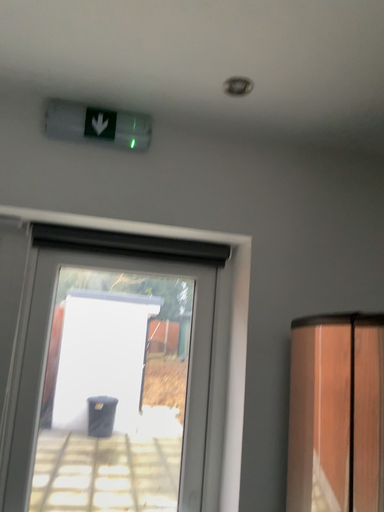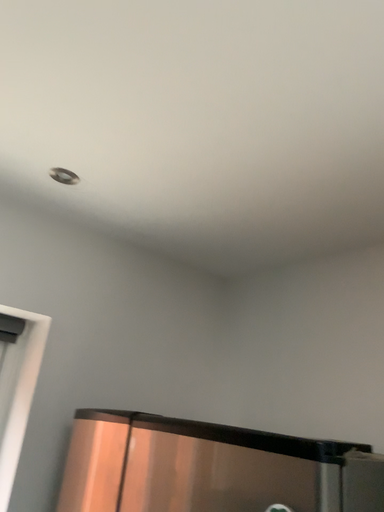
Question: Which way did the camera rotate in the video?

Choices:
 (A) rotated downward
 (B) rotated upward

Answer: (B)